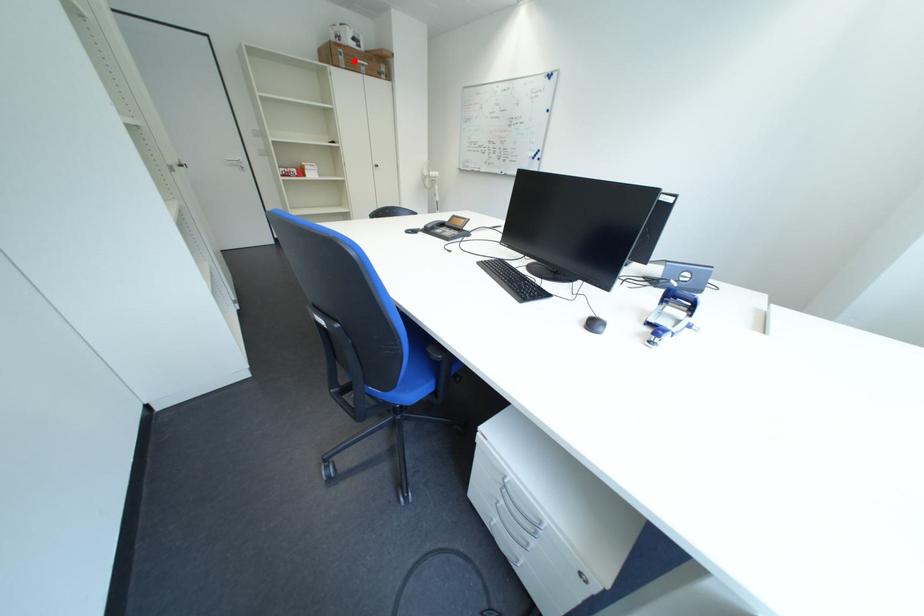
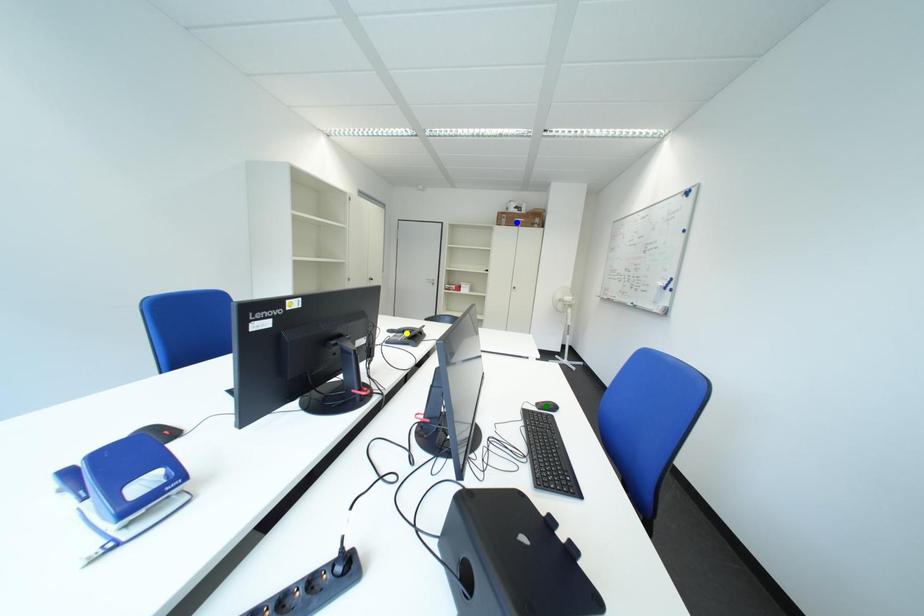
Question: I am providing you with two images of the same scene from different viewpoints. A red point is marked on the first image. You are given multiple points on the second image. Which point in image 2 represents the same 3d spot as the red point in image 1?

Choices:
 (A) blue point
 (B) yellow point
 (C) green point

Answer: (A)